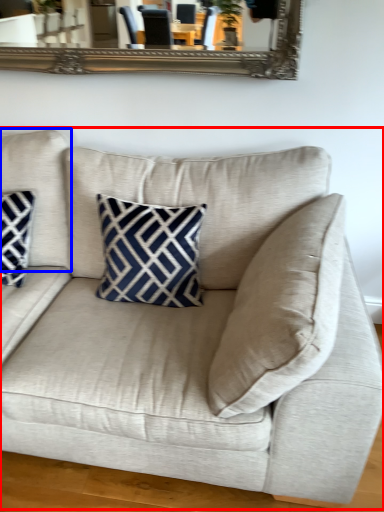
Question: Which of the following is the farthest to the observer, studio couch (highlighted by a red box) or pillow (highlighted by a blue box)?

Choices:
 (A) studio couch
 (B) pillow

Answer: (B)